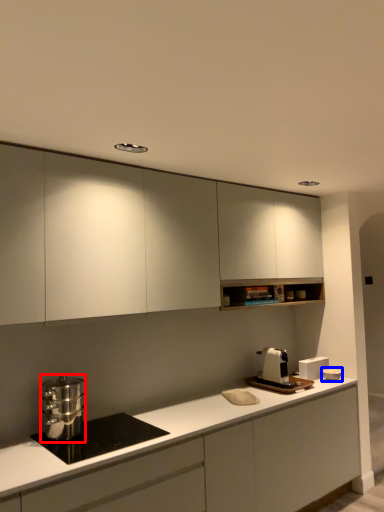
Question: Which point is closer to the camera, kitchen appliance (highlighted by a red box) or appliance (highlighted by a blue box)?

Choices:
 (A) kitchen appliance
 (B) appliance

Answer: (A)